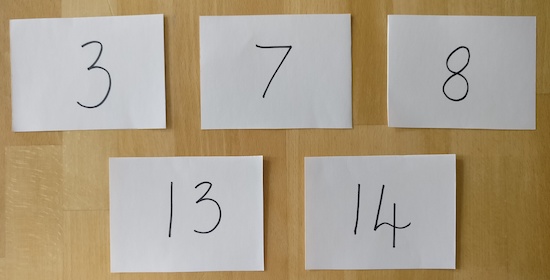
This screenshot has height=280, width=550. Identify the location of table. (65, 201).